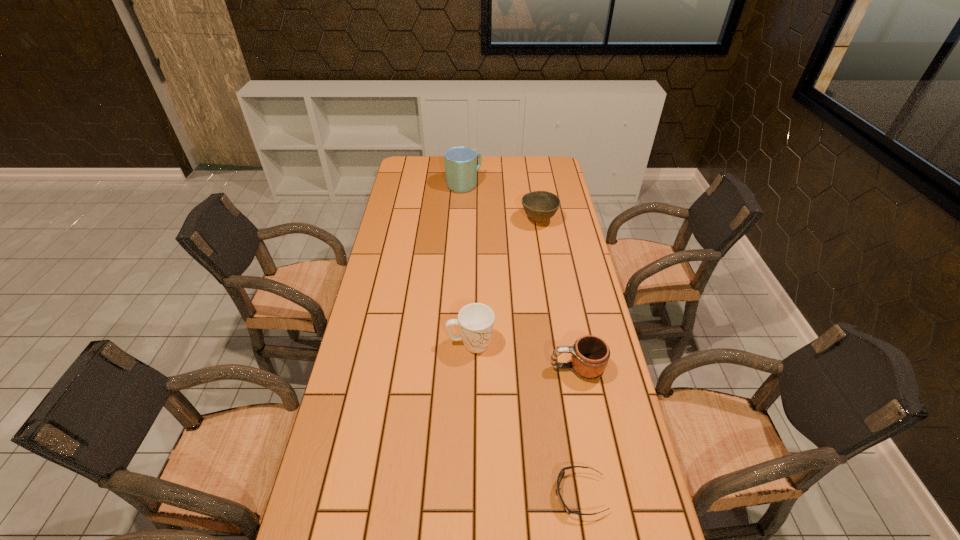
This screenshot has height=540, width=960. I want to click on free point between the second tallest object and the nearest object, so click(525, 419).

Where is `free space between the shortest mug and the tallest object`? This screenshot has height=540, width=960. free space between the shortest mug and the tallest object is located at coordinates (520, 276).

Find the location of a particular element. The height and width of the screenshot is (540, 960). free space that is in between the second shortest mug and the nearest object is located at coordinates (525, 419).

What are the coordinates of `empty location between the bowl and the second tallest mug` in the screenshot? It's located at (505, 282).

Identify which object is the third closest to the goggles. Please provide its 2D coordinates. Your answer should be formatted as a tuple, i.e. [(x, y)], where the tuple contains the x and y coordinates of a point satisfying the conditions above.

[(540, 206)]

In order to click on object that is the third closest one to the goggles in this screenshot , I will do `click(540, 206)`.

Locate an element on the screen. This screenshot has width=960, height=540. mug that is the second closest to the goggles is located at coordinates (475, 321).

The height and width of the screenshot is (540, 960). What are the coordinates of `the second closest mug relative to the second tallest object` in the screenshot? It's located at (461, 167).